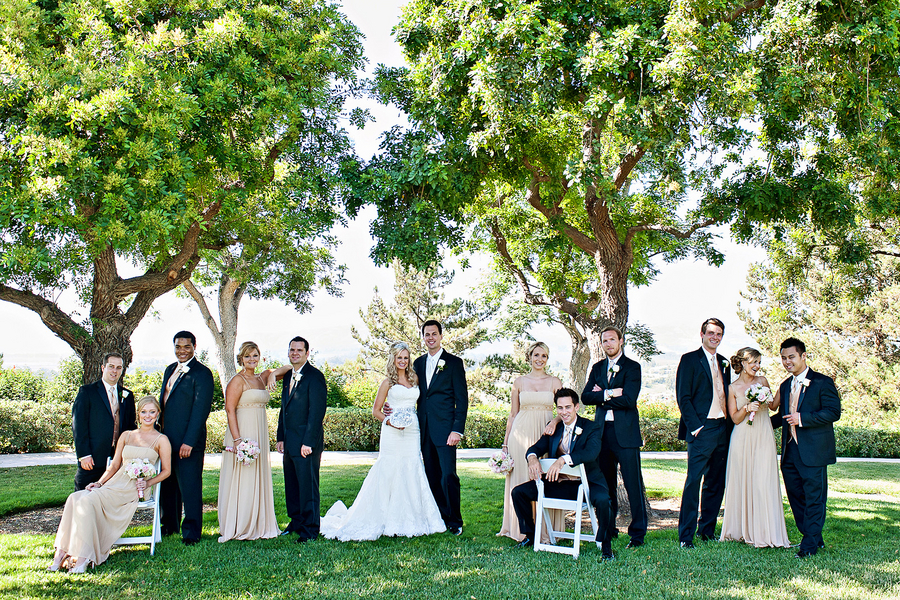
You are a GUI agent. You are given a task and a screenshot of the screen. Output one action in this format:
    pyautogui.click(x=<x>, y=<y>)
    Task: Click on the flower bouquet
    This screenshot has height=600, width=900.
    Given the screenshot: What is the action you would take?
    pyautogui.click(x=136, y=469), pyautogui.click(x=231, y=448), pyautogui.click(x=394, y=415), pyautogui.click(x=757, y=387), pyautogui.click(x=506, y=462)